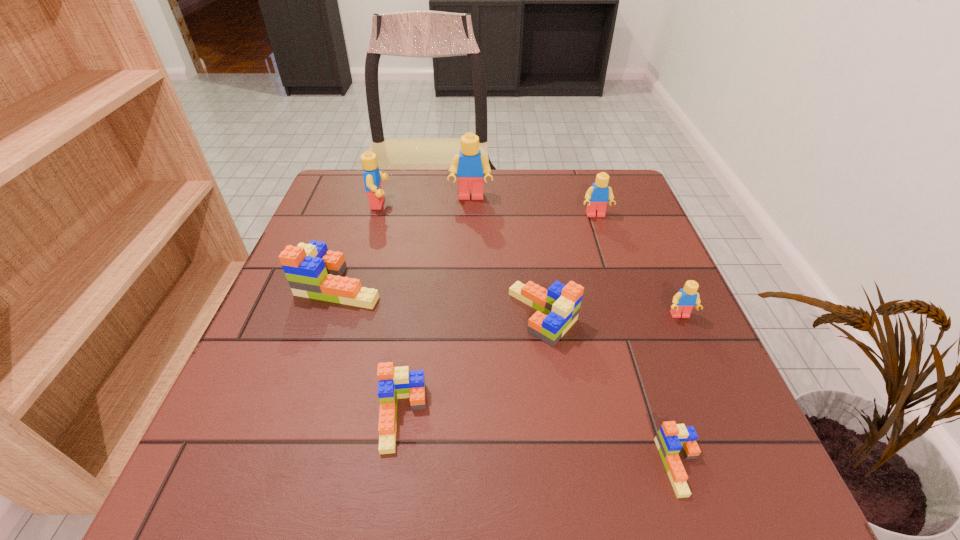
Find the location of a particular element. vacant space located 0.120m on the right of the third Lego from left to right is located at coordinates (497, 417).

Where is `vacant area located on the back of the shortest object`? vacant area located on the back of the shortest object is located at coordinates (626, 302).

You are a GUI agent. You are given a task and a screenshot of the screen. Output one action in this format:
    pyautogui.click(x=<x>, y=<y>)
    Task: Click on the object located at the far left corner
    The height and width of the screenshot is (540, 960).
    Given the screenshot: What is the action you would take?
    pyautogui.click(x=372, y=176)

This screenshot has height=540, width=960. In order to click on object located in the far right corner section of the desktop in this screenshot , I will do `click(597, 196)`.

Identify the location of object that is at the near right corner. The width and height of the screenshot is (960, 540). (671, 438).

Where is `free space at the far edge of the desktop`? The image size is (960, 540). free space at the far edge of the desktop is located at coordinates (558, 195).

Identify the location of free space at the near edge of the desktop. The image size is (960, 540). (x=418, y=475).

Locate an element on the screen. This screenshot has height=540, width=960. free space at the left edge is located at coordinates (324, 332).

Where is `vacant space at the right edge of the desktop`? vacant space at the right edge of the desktop is located at coordinates pyautogui.click(x=655, y=390).

The height and width of the screenshot is (540, 960). Find the location of `free location at the far left corner`. free location at the far left corner is located at coordinates (355, 206).